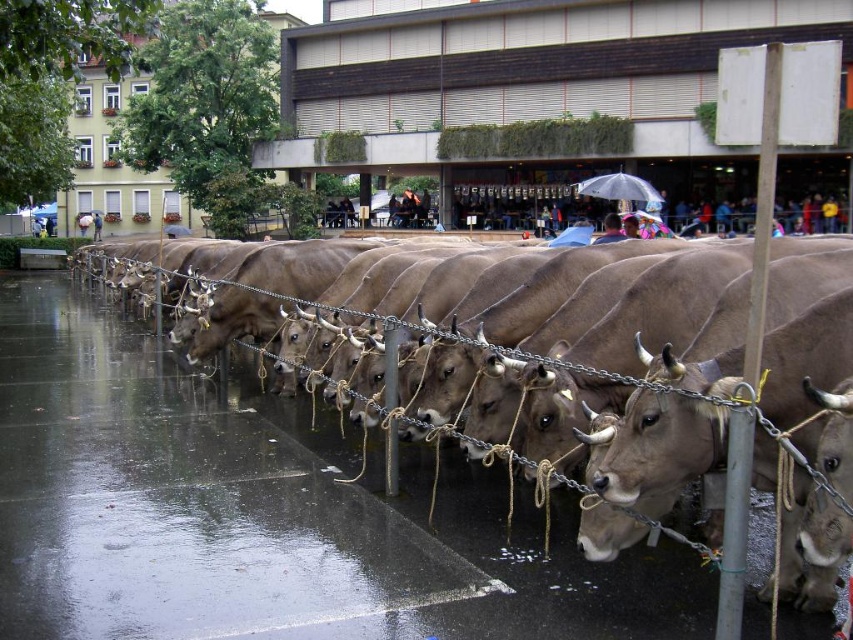
Between brown smooth pavement at center and transparent plastic umbrella at center, which one is positioned lower?

brown smooth pavement at center

Can you confirm if brown smooth pavement at center is positioned to the left of transparent plastic umbrella at center?

Indeed, brown smooth pavement at center is positioned on the left side of transparent plastic umbrella at center.

You are a GUI agent. You are given a task and a screenshot of the screen. Output one action in this format:
    pyautogui.click(x=<x>, y=<y>)
    Task: Click on the brown smooth pavement at center
    The image size is (853, 640).
    Given the screenshot: What is the action you would take?
    pyautogui.click(x=265, y=513)